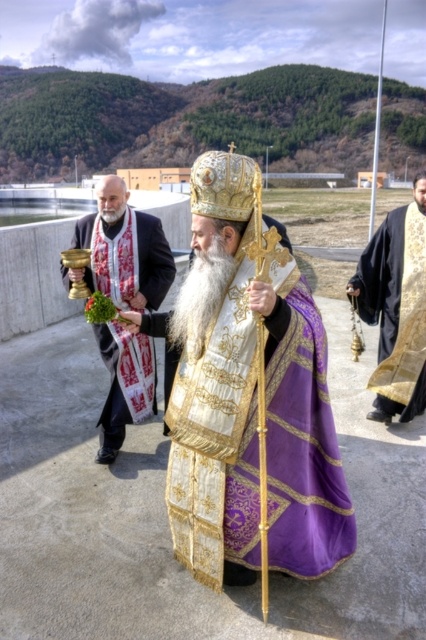
Question: Which object is closer to the camera taking this photo?

Choices:
 (A) black velvet robe at right
 (B) purple silk robe at center

Answer: (B)

Question: Is purple silk robe at center thinner than black velvet robe at right?

Choices:
 (A) no
 (B) yes

Answer: (A)

Question: Which point is closer to the camera?

Choices:
 (A) (192, 400)
 (B) (403, 380)

Answer: (A)

Question: Is purple silk robe at center to the left of gold metallic chalice at left from the viewer's perspective?

Choices:
 (A) yes
 (B) no

Answer: (B)

Question: In this image, where is gold metallic chalice at left located relative to black velvet robe at right?

Choices:
 (A) right
 (B) left

Answer: (B)

Question: Which point is farther from the camera taking this photo?

Choices:
 (A) (391, 256)
 (B) (103, 342)
 (C) (333, 525)

Answer: (A)